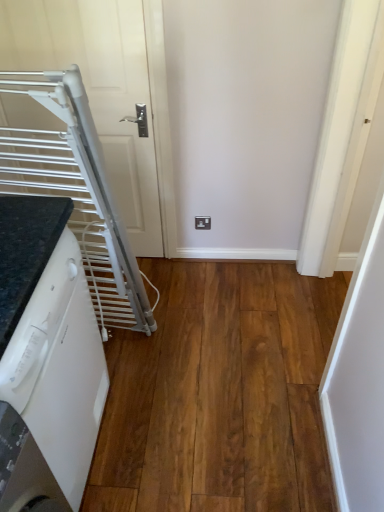
Identify the location of vacant space situated above brown wood flooring at lower left (from a real-world perspective). (196, 366).